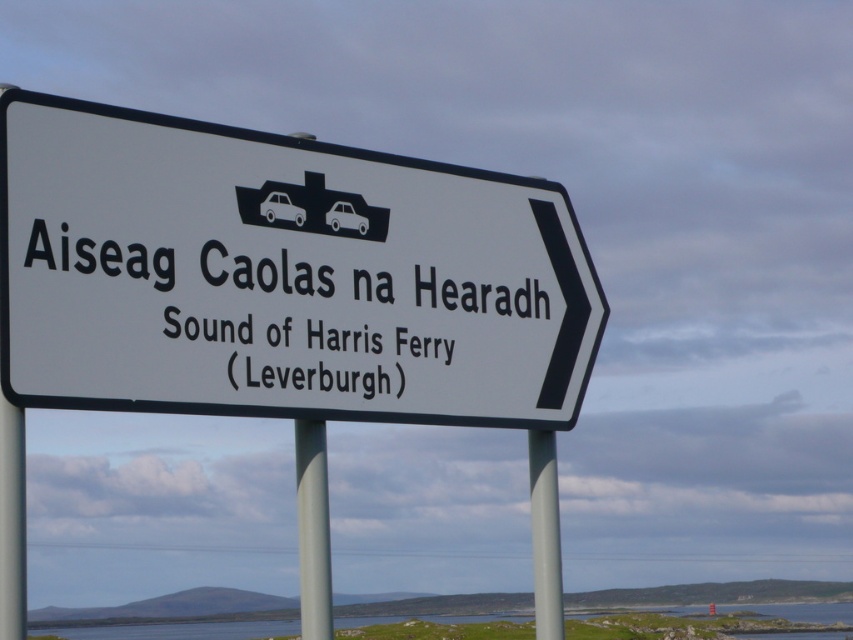
You are standing at the point marked by the coordinates point (x=280, y=276) in the image, which is the white plastic sign at center. The sign points to the right and mentions the Sound of Harris Ferry in Leverburgh. If you want to reach the ferry terminal, which direction should you walk relative to the sign?

The sign points to the right, so you should walk in the direction the sign is pointing, which is to the right, to reach the Sound of Harris Ferry terminal in Leverburgh.

You are driving and see two signs at the center of your view, a white plastic sign at center and a white paper sign at center. Which one is positioned to the right side?

The white plastic sign at center is positioned to the right of the white paper sign at center.

You are driving a large truck and want to reach the ferry terminal indicated by the white plastic sign at center. You notice the white plastic pole at left is in your path. Can you drive around the pole to reach the sign?

The white plastic pole at left is behind the white plastic sign at center, so the pole is not blocking your path to the sign. You can drive straight toward the sign without needing to go around the pole.